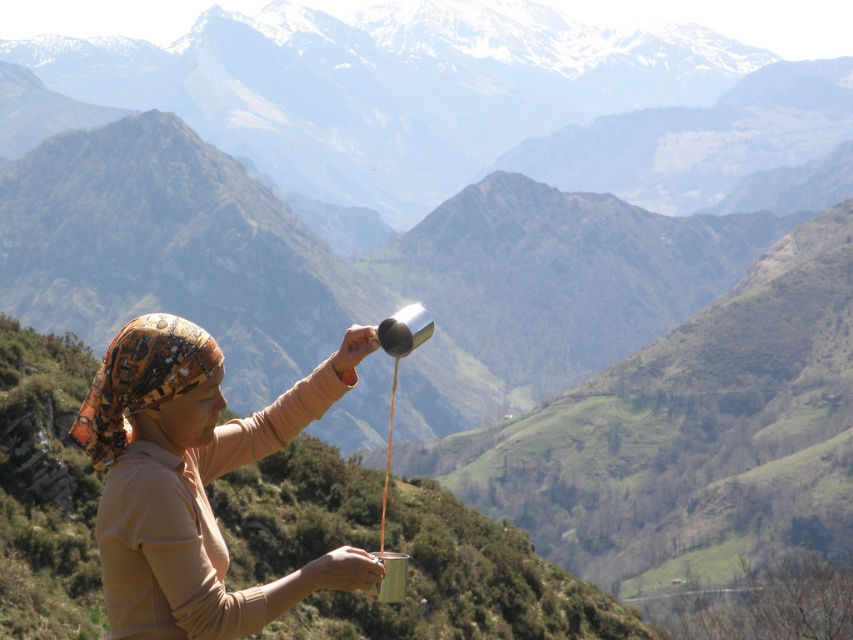
The height and width of the screenshot is (640, 853). I want to click on matte beige shirt at center, so click(x=193, y=481).

Between matte beige shirt at center and printed silk headscarf at left, which one appears on the left side from the viewer's perspective?

From the viewer's perspective, printed silk headscarf at left appears more on the left side.

Is point (149, 397) in front of point (190, 369)?

Yes, it is.

Image resolution: width=853 pixels, height=640 pixels. Identify the location of matte beige shirt at center. (193, 481).